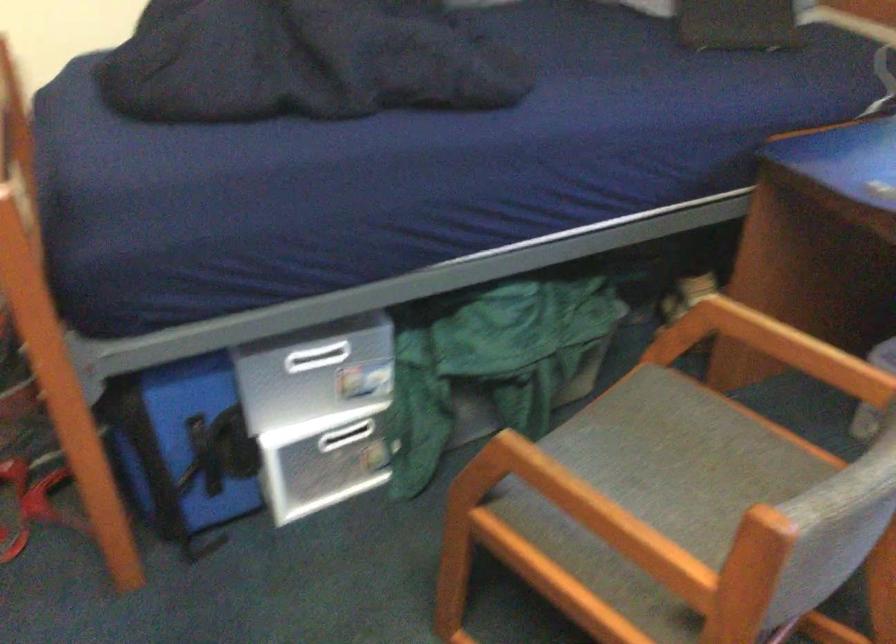
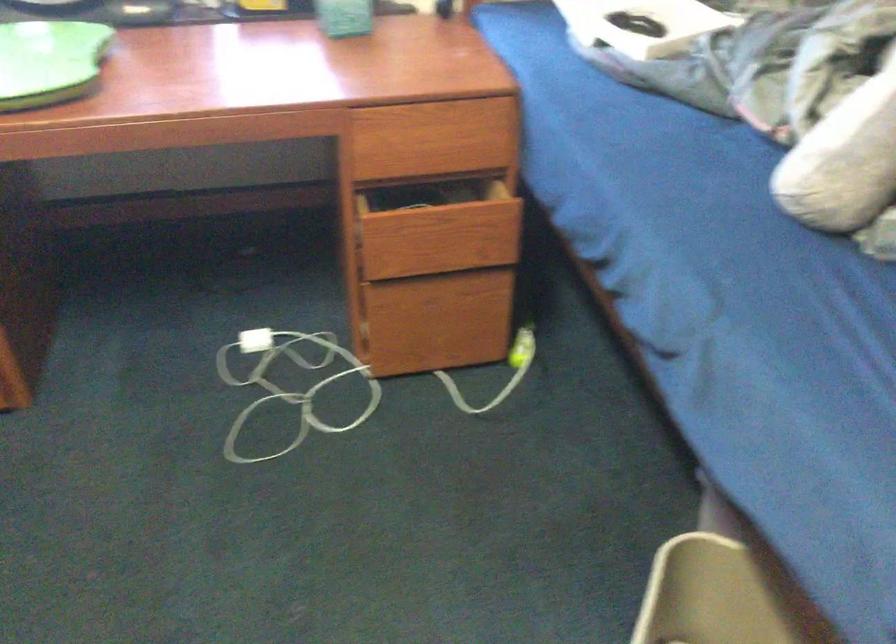
Consider the image. The first image is from the beginning of the video and the second image is from the end. How did the camera likely rotate when shooting the video?

The camera rotated toward right-down.